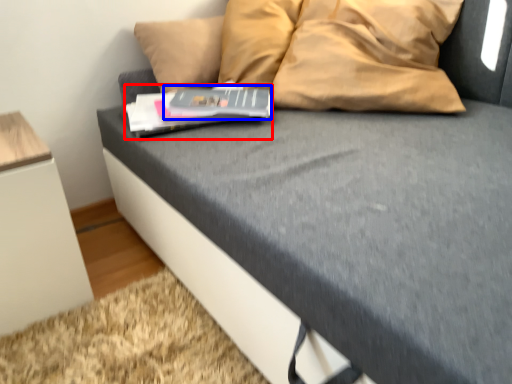
Question: Which point is further to the camera, paperback book (highlighted by a red box) or paperback book (highlighted by a blue box)?

Choices:
 (A) paperback book
 (B) paperback book

Answer: (B)